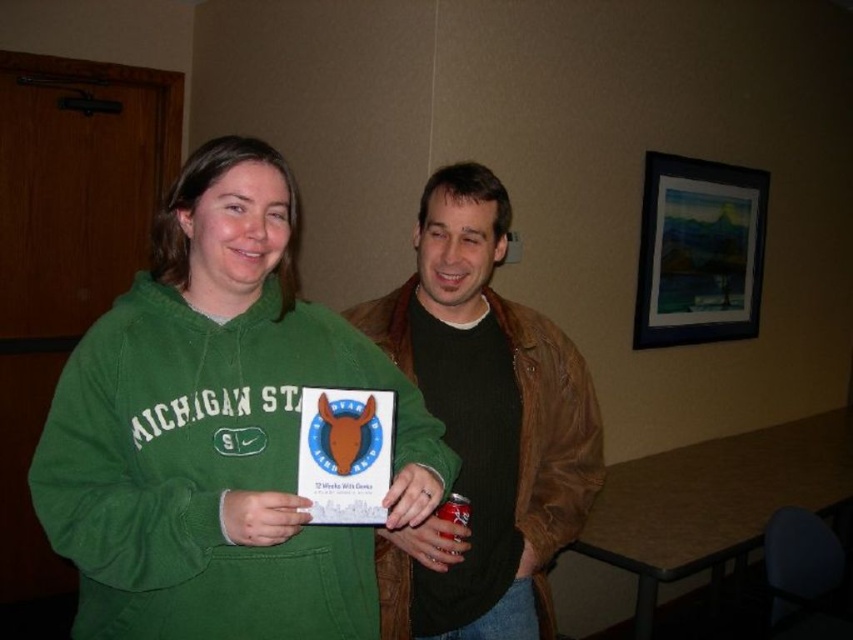
Identify the location of green fleece sweatshirt at center. (218, 429).

Is point (154, 301) positioned behind point (450, 193)?

No, (154, 301) is closer to viewer.

You are a GUI agent. You are given a task and a screenshot of the screen. Output one action in this format:
    pyautogui.click(x=<x>, y=<y>)
    Task: Click on the green fleece sweatshirt at center
    The image size is (853, 640).
    Given the screenshot: What is the action you would take?
    pyautogui.click(x=218, y=429)